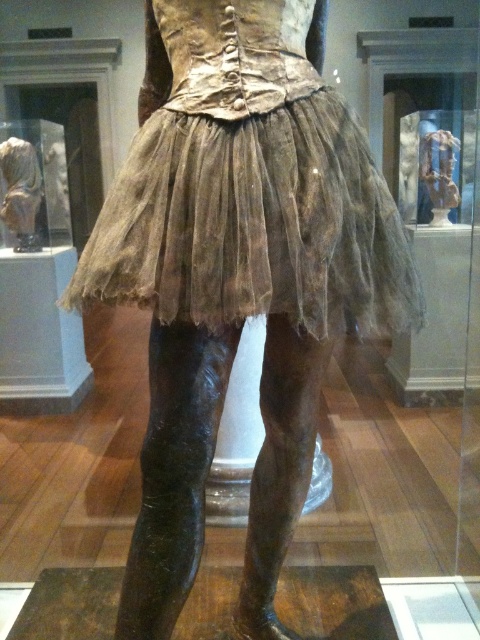
You are an art curator planning to move the matte bronze statue at center and the matte bronze statue at upper right to a new gallery layout. If you want to maintain their vertical relationship as shown in the original image, which statue should be placed higher on the wall?

The matte bronze statue at upper right should be placed higher on the wall since in the original image, the matte bronze statue at center is below the matte bronze statue at upper right.

You are an art conservator examining the sculpture. You notice two points on the sculpture marked at coordinates point [81,285] and point [9,150]. Which point is positioned closer to your viewpoint?

Point [81,285] is closer to the viewer than point [9,150].